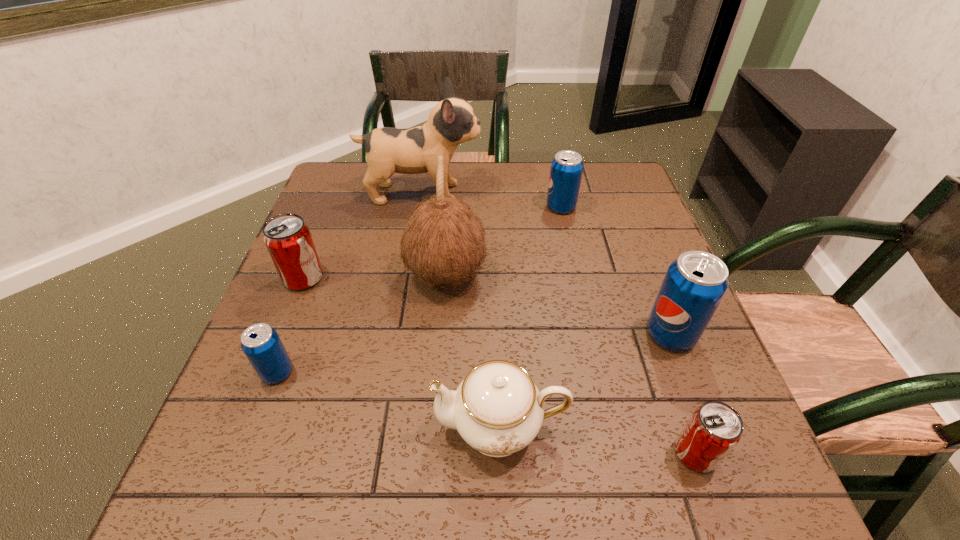
This screenshot has width=960, height=540. In order to click on the smallest blue pop soda in this screenshot , I will do `click(261, 344)`.

Find the location of a particular element. The width and height of the screenshot is (960, 540). the nearer red pop soda is located at coordinates pyautogui.click(x=715, y=428).

In order to click on the smaller red pop soda in this screenshot , I will do `click(715, 428)`.

Locate an element on the screen. free space located at the face of the puppy is located at coordinates (518, 193).

You are a GUI agent. You are given a task and a screenshot of the screen. Output one action in this format:
    pyautogui.click(x=<x>, y=<y>)
    Task: Click on the free space located on the surface of the coconut
    This screenshot has width=960, height=540.
    Given the screenshot: What is the action you would take?
    pyautogui.click(x=599, y=275)

The height and width of the screenshot is (540, 960). What are the coordinates of `free space located on the back of the tallest pop soda` in the screenshot? It's located at (638, 251).

The width and height of the screenshot is (960, 540). Find the location of `free spot located 0.280m on the left of the sixth object from left to right`. free spot located 0.280m on the left of the sixth object from left to right is located at coordinates (445, 207).

The width and height of the screenshot is (960, 540). I want to click on free spot located 0.090m on the back of the fourth nearest pop soda, so click(x=319, y=240).

At what (x,y) coordinates should I click in order to perform the action: click on free point located at the spout of the chinaware. Please return your answer as a coordinate pair (x, y). The height and width of the screenshot is (540, 960). Looking at the image, I should click on (286, 427).

Where is `free space located at the spout of the chinaware`? The height and width of the screenshot is (540, 960). free space located at the spout of the chinaware is located at coordinates (377, 427).